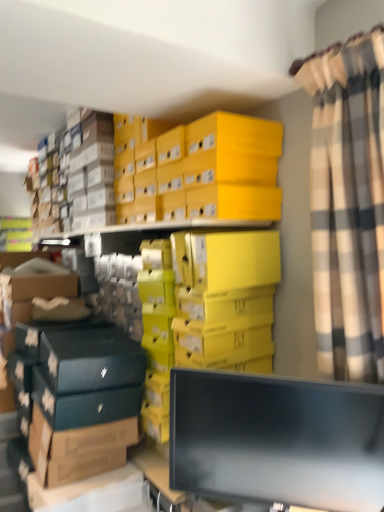
Question: Can you confirm if black glossy monitor at lower center is positioned to the right of plaid fabric curtain at right?

Choices:
 (A) no
 (B) yes

Answer: (A)

Question: Can you confirm if black glossy monitor at lower center is bigger than plaid fabric curtain at right?

Choices:
 (A) yes
 (B) no

Answer: (B)

Question: Could you tell me if black glossy monitor at lower center is turned towards plaid fabric curtain at right?

Choices:
 (A) no
 (B) yes

Answer: (A)

Question: Does black glossy monitor at lower center have a greater height compared to plaid fabric curtain at right?

Choices:
 (A) no
 (B) yes

Answer: (A)

Question: Can you confirm if black glossy monitor at lower center is shorter than plaid fabric curtain at right?

Choices:
 (A) no
 (B) yes

Answer: (B)

Question: Is plaid fabric curtain at right inside the boundaries of black glossy monitor at lower center, or outside?

Choices:
 (A) inside
 (B) outside

Answer: (B)

Question: Considering their positions, is plaid fabric curtain at right located in front of or behind black glossy monitor at lower center?

Choices:
 (A) front
 (B) behind

Answer: (A)

Question: From the image's perspective, is plaid fabric curtain at right positioned above or below black glossy monitor at lower center?

Choices:
 (A) below
 (B) above

Answer: (B)

Question: From a real-world perspective, is plaid fabric curtain at right physically located above or below black glossy monitor at lower center?

Choices:
 (A) above
 (B) below

Answer: (A)

Question: From their relative heights in the image, would you say yellow cardboard box at upper center is taller or shorter than plaid fabric curtain at right?

Choices:
 (A) short
 (B) tall

Answer: (A)

Question: Looking at their shapes, would you say yellow cardboard box at upper center is wider or thinner than plaid fabric curtain at right?

Choices:
 (A) thin
 (B) wide

Answer: (B)

Question: Is yellow cardboard box at upper center bigger or smaller than plaid fabric curtain at right?

Choices:
 (A) big
 (B) small

Answer: (A)

Question: Considering their positions, is yellow cardboard box at upper center located in front of or behind plaid fabric curtain at right?

Choices:
 (A) front
 (B) behind

Answer: (B)

Question: Visually, is yellow cardboard box at upper center positioned to the left or to the right of black glossy monitor at lower center?

Choices:
 (A) right
 (B) left

Answer: (B)

Question: Considering their positions, is yellow cardboard box at upper center located in front of or behind black glossy monitor at lower center?

Choices:
 (A) front
 (B) behind

Answer: (B)